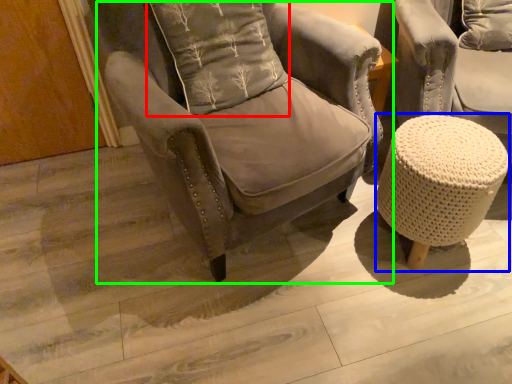
Question: Which is nearer to the pillow (highlighted by a red box)? bar stool (highlighted by a blue box) or chair (highlighted by a green box).

Choices:
 (A) bar stool
 (B) chair

Answer: (B)